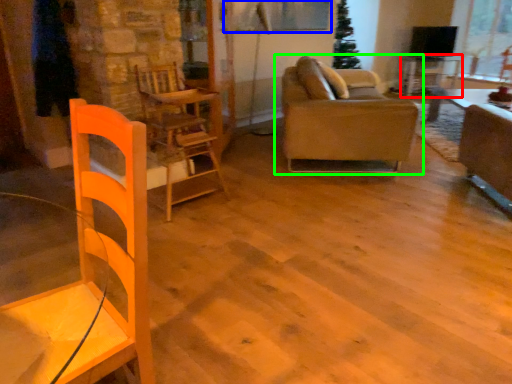
Question: Estimate the real-world distances between objects in this image. Which object is closer to table (highlighted by a red box), window screen (highlighted by a blue box) or studio couch (highlighted by a green box)?

Choices:
 (A) window screen
 (B) studio couch

Answer: (A)